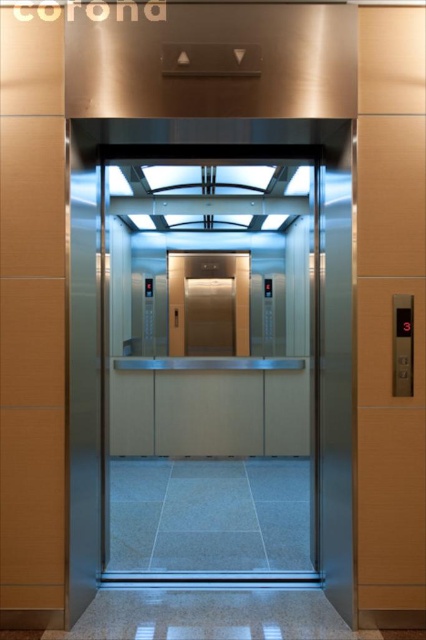
You are standing in front of two elevators at the lobby. The transparent glass elevator at center and the polished brass elevator at center. Which one is closer to you?

The transparent glass elevator at center is closer to the viewer than the polished brass elevator at center.

You are standing in the elevator and want to reach the control panel located at the top. Which elevator, the transparent glass elevator at center or the polished brass elevator at center, will allow you to reach the control panel without needing a stool?

The transparent glass elevator at center is much taller than the polished brass elevator at center, so you can reach the control panel without needing a stool in the transparent glass elevator at center.